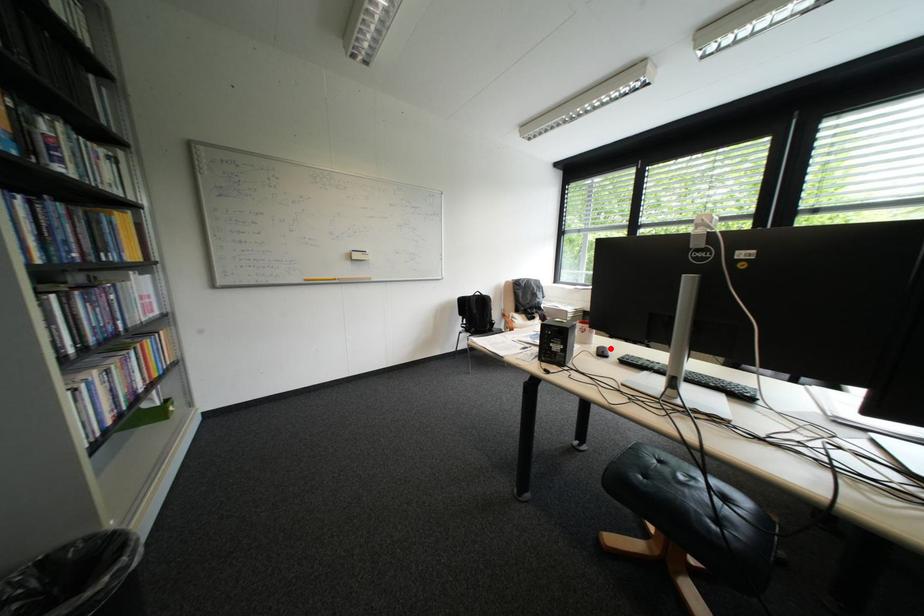
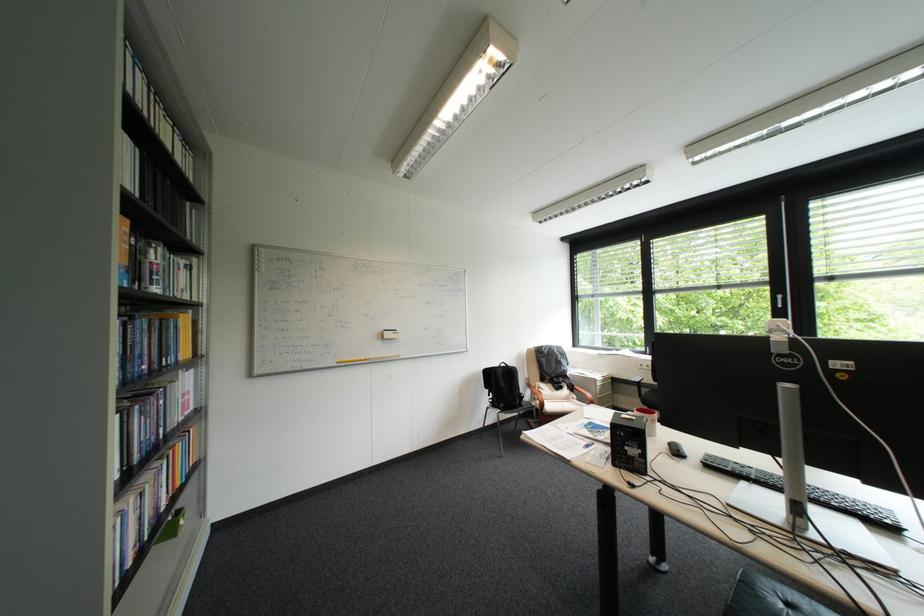
The point at the highlighted location is marked in the first image. Where is the corresponding point in the second image?

(682, 445)